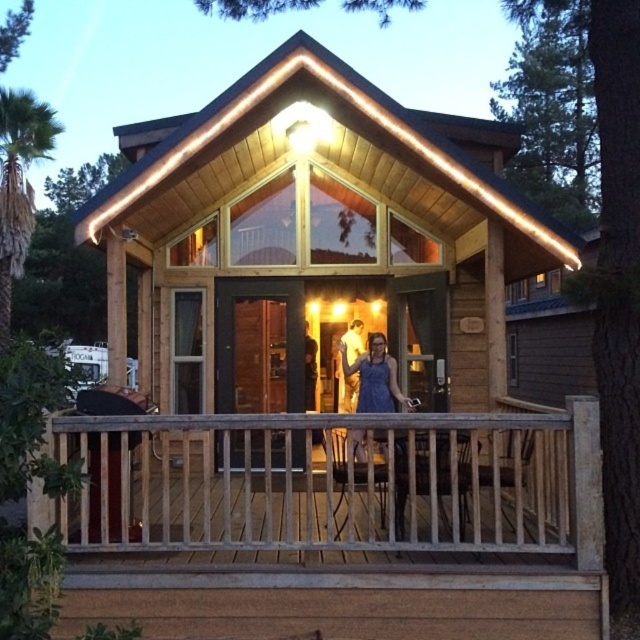
Which is more to the right, wooden cabin at center or blue denim dress at center?

wooden cabin at center

Between point (440, 182) and point (396, 394), which one is positioned in front?

Point (440, 182)

This screenshot has height=640, width=640. I want to click on wooden cabin at center, so click(x=316, y=241).

From the picture: Who is shorter, wooden cabin at center or matte blue dress at center?

Standing shorter between the two is matte blue dress at center.

Can you confirm if wooden cabin at center is bigger than matte blue dress at center?

No.

Identify the location of wooden cabin at center. pos(316,241).

Between blue denim dress at center and matte blue dress at center, which one is positioned lower?

blue denim dress at center is lower down.

Who is positioned more to the left, blue denim dress at center or matte blue dress at center?

matte blue dress at center is more to the left.

Is point (360, 452) closer to viewer compared to point (355, 330)?

Yes, it is.

Locate an element on the screen. blue denim dress at center is located at coordinates (376, 378).